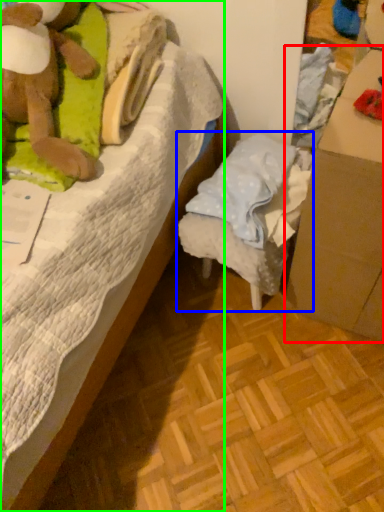
Question: Which object is positioned closest to cardboard box (highlighted by a red box)? Select from furniture (highlighted by a blue box) and bed (highlighted by a green box).

Choices:
 (A) furniture
 (B) bed

Answer: (A)